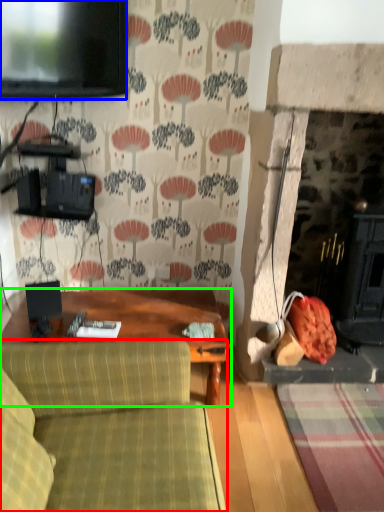
Question: Based on their relative distances, which object is nearer to studio couch (highlighted by a red box)? Choose from television (highlighted by a blue box) and table (highlighted by a green box).

Choices:
 (A) television
 (B) table

Answer: (B)